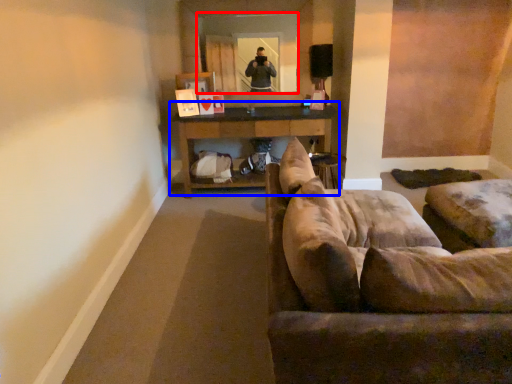
Question: Which of the following is the closest to the observer, mirror (highlighted by a red box) or table (highlighted by a blue box)?

Choices:
 (A) mirror
 (B) table

Answer: (B)